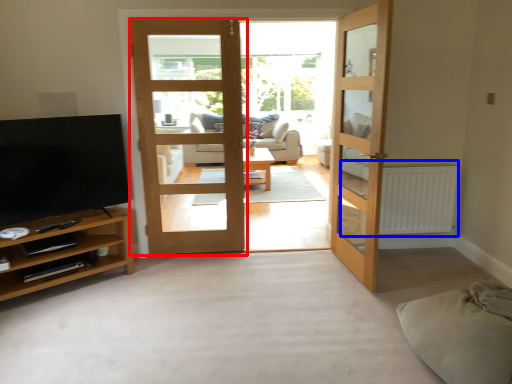
Question: Which of the following is the closest to the observer, door (highlighted by a red box) or radiator (highlighted by a blue box)?

Choices:
 (A) door
 (B) radiator

Answer: (A)